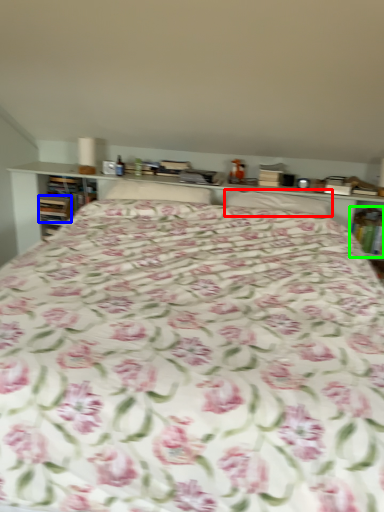
Question: Considering the real-world distances, which object is farthest from pillow (highlighted by a red box)? book (highlighted by a blue box) or book (highlighted by a green box)?

Choices:
 (A) book
 (B) book

Answer: (A)